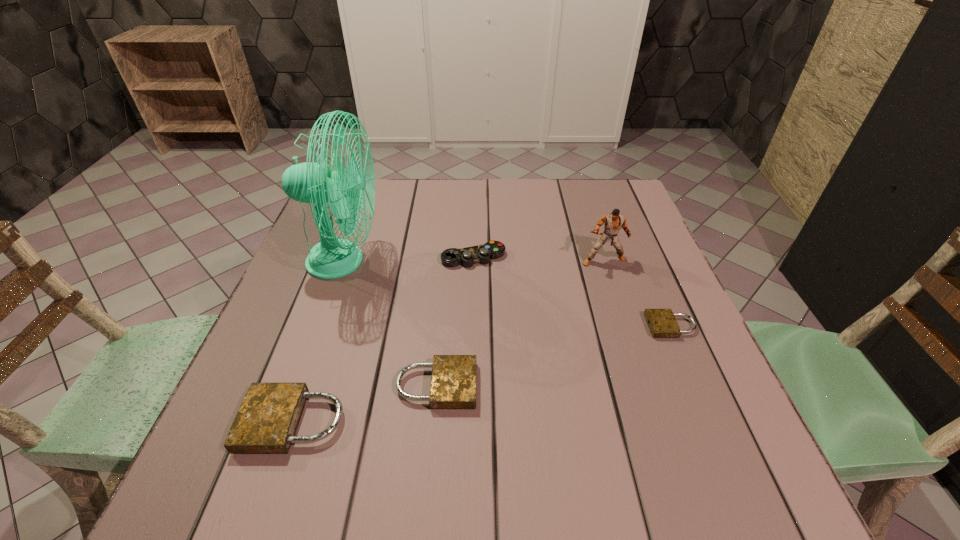
You are a GUI agent. You are given a task and a screenshot of the screen. Output one action in this format:
    pyautogui.click(x=<x>, y=<y>)
    Task: Click on the vacant space situated on the keyhole side of the farthest padlock
    The height and width of the screenshot is (540, 960).
    Given the screenshot: What is the action you would take?
    pyautogui.click(x=592, y=326)

Locate an element on the screen. The height and width of the screenshot is (540, 960). free region located in front of the tallest object to blow air is located at coordinates (508, 261).

Where is `vacant space located 0.230m on the front-facing side of the puncher`? Image resolution: width=960 pixels, height=540 pixels. vacant space located 0.230m on the front-facing side of the puncher is located at coordinates tap(630, 340).

Identify the location of vacant space located on the back of the control. The image size is (960, 540). (x=474, y=211).

Where is `padlock located at the left edge`? This screenshot has height=540, width=960. padlock located at the left edge is located at coordinates (266, 423).

Image resolution: width=960 pixels, height=540 pixels. Identify the location of fan present at the left edge. (333, 257).

Identify the location of padlock located in the right edge section of the desktop. This screenshot has height=540, width=960. (662, 323).

This screenshot has height=540, width=960. I want to click on puncher at the right edge, so click(x=613, y=222).

Locate an element on the screen. The width and height of the screenshot is (960, 540). object that is at the near left corner is located at coordinates (266, 423).

Locate an element on the screen. The width and height of the screenshot is (960, 540). free space at the far edge is located at coordinates (x=486, y=223).